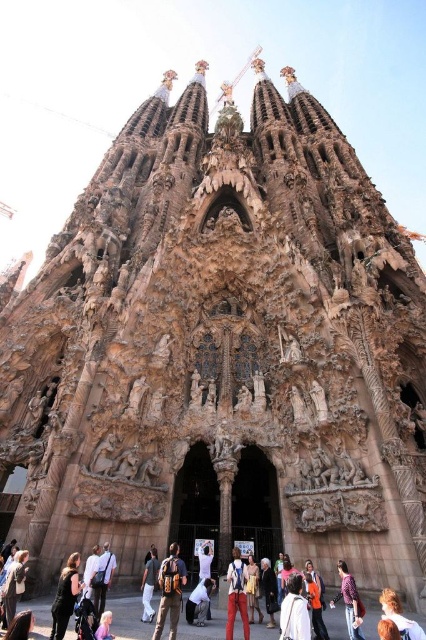
You are standing at the point marked as point (58,593) and want to take a photo of the Sagrada Familia. If your camera can focus on objects up to 200 feet away, will the Sagrada Familia be in focus?

The distance between point (58,593) and the camera is 184.87 feet, which is within the camera focus range of 200 feet. Therefore, the Sagrada Familia will be in focus.

From the picture: Please see the image of Sagrada Familia. There is a point at coordinate (x=65, y=596). What object is located at this coordinate? The objects in the image are the black leather jacket at lower left and the Sagrada Familia facade. Please answer with the object name.

The point at coordinate (x=65, y=596) is located on the black leather jacket at lower left.